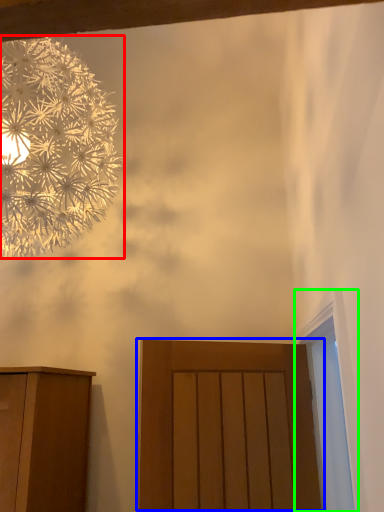
Question: Which object is positioned closest to flower (highlighted by a red box)? Select from door (highlighted by a blue box) and window (highlighted by a green box).

Choices:
 (A) door
 (B) window

Answer: (A)